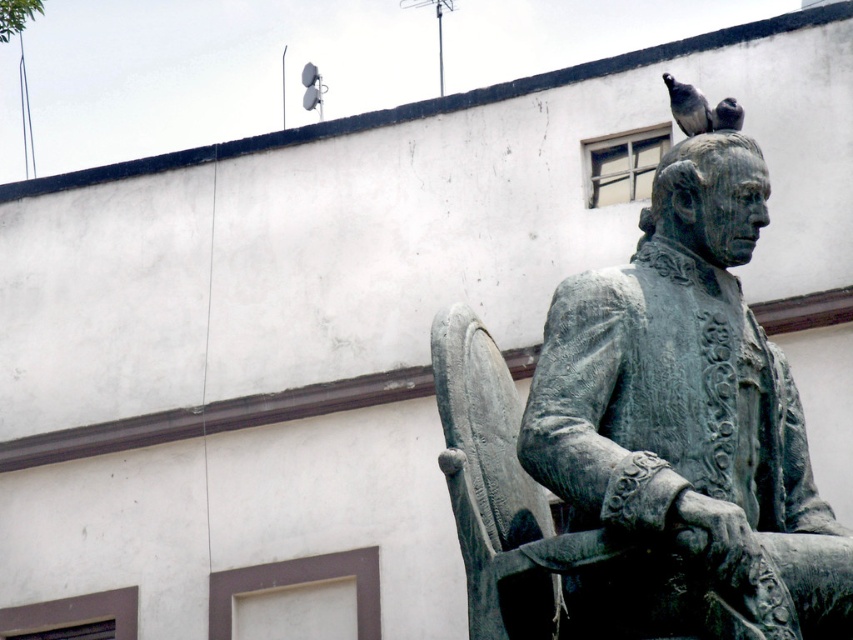
You are an art student analyzing the image. You notice the bronze statue at upper right and the dark gray feathers at upper center. Which object takes up more space in the image?

The bronze statue at upper right is larger in size than the dark gray feathers at upper center, so it takes up more space in the image.